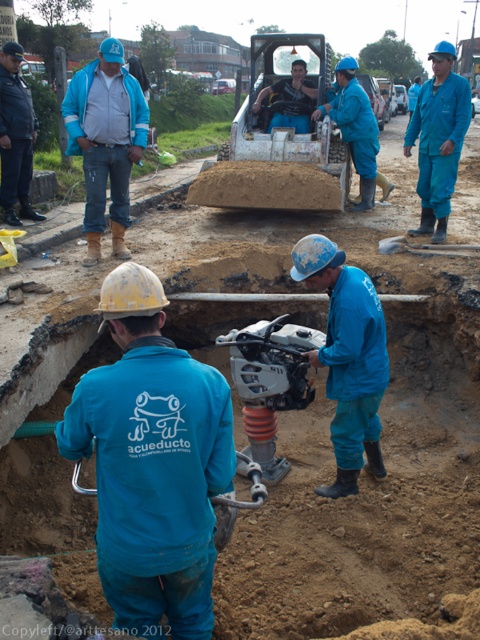
Does point (333, 298) come farther from viewer compared to point (280, 93)?

That is False.

Is blue matte uniform at center smaller than matte blue helmet at center?

Indeed, blue matte uniform at center has a smaller size compared to matte blue helmet at center.

Who is more forward, (374,362) or (299,108)?

Positioned in front is point (374,362).

I want to click on blue matte uniform at center, so click(x=348, y=358).

Is blue matte uniform at center closer to camera compared to blue matte jumpsuit at center?

Yes, it is.

Does blue matte uniform at center appear on the right side of blue matte jumpsuit at center?

No, blue matte uniform at center is not to the right of blue matte jumpsuit at center.

Does point (360, 289) lie behind point (441, 160)?

That is False.

At what (x,y) coordinates should I click in order to perform the action: click on blue matte uniform at center. Please return your answer as a coordinate pair (x, y). This screenshot has height=640, width=480. Looking at the image, I should click on (348, 358).

From the picture: Which is more to the left, blue matte jumpsuit at center or blue uniform at center?

blue uniform at center

What do you see at coordinates (439, 138) in the screenshot?
I see `blue matte jumpsuit at center` at bounding box center [439, 138].

Find the location of a particular element. The width and height of the screenshot is (480, 640). blue matte jumpsuit at center is located at coordinates (439, 138).